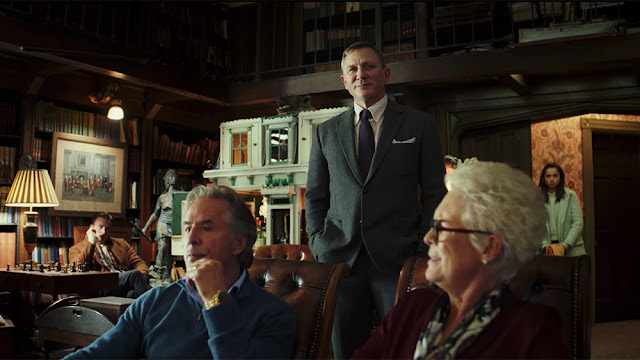
The width and height of the screenshot is (640, 360). Identify the location of leather chairs. (281, 275), (300, 254), (569, 275), (417, 277).